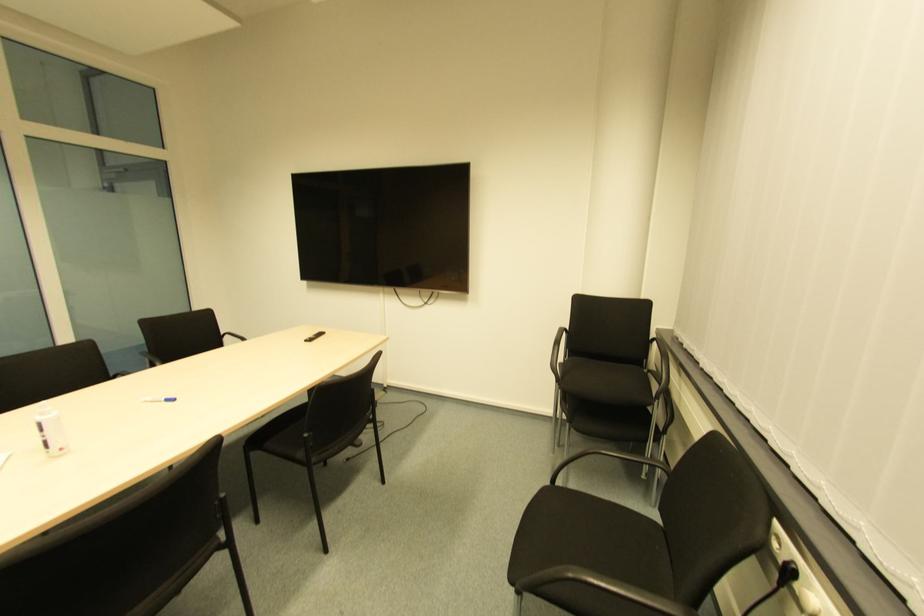
Identify the location of black power plug. This screenshot has width=924, height=616. (786, 573).